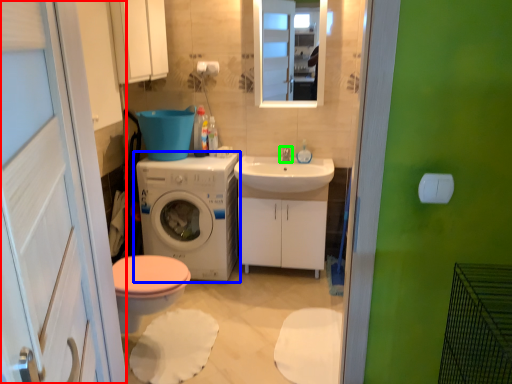
Question: Which object is positioned closest to screen door (highlighted by a red box)? Select from washing machine (highlighted by a blue box) and tap (highlighted by a green box).

Choices:
 (A) washing machine
 (B) tap

Answer: (A)